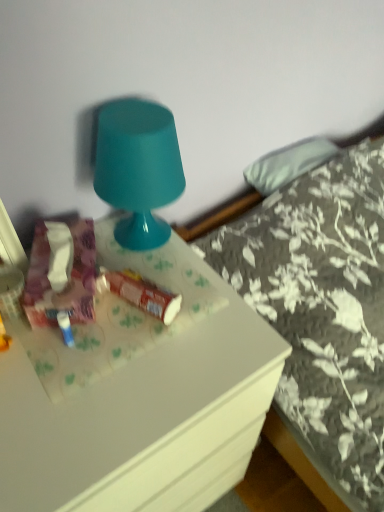
The height and width of the screenshot is (512, 384). Identify the location of vacant point to the right of matte plastic tube at center, arranged as the first stuff when viewed from the right. (213, 315).